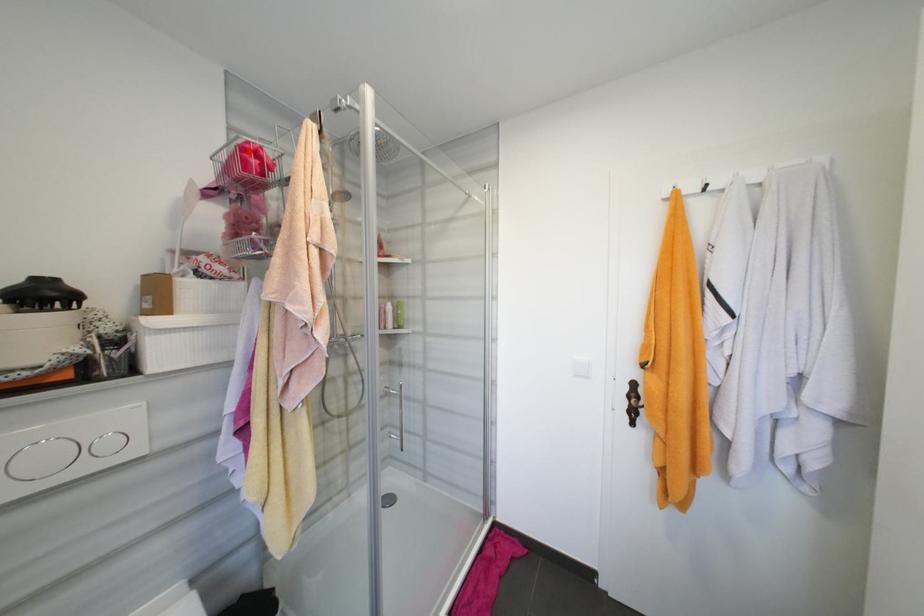
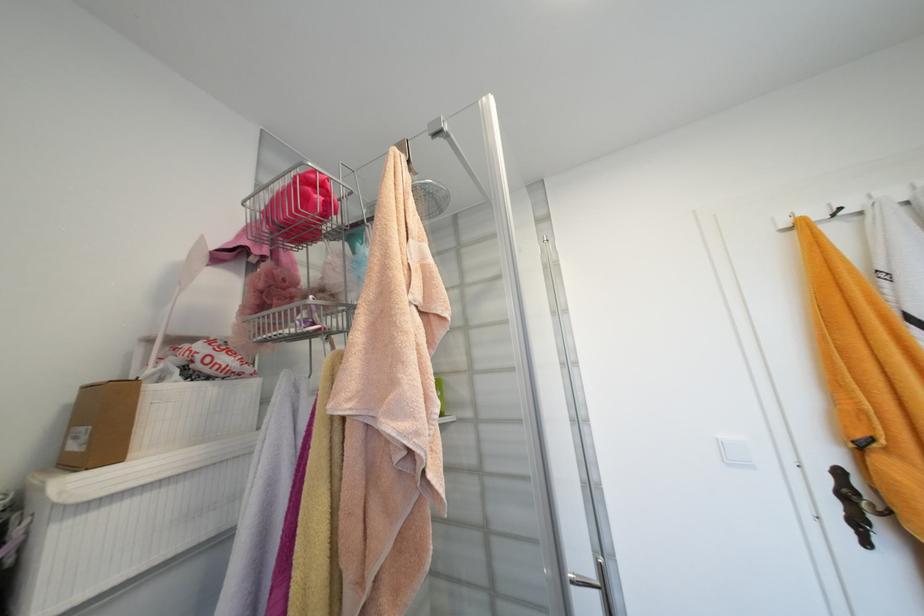
Where in the second image is the point corresponding to the highlighted location from the first image?

(312, 182)